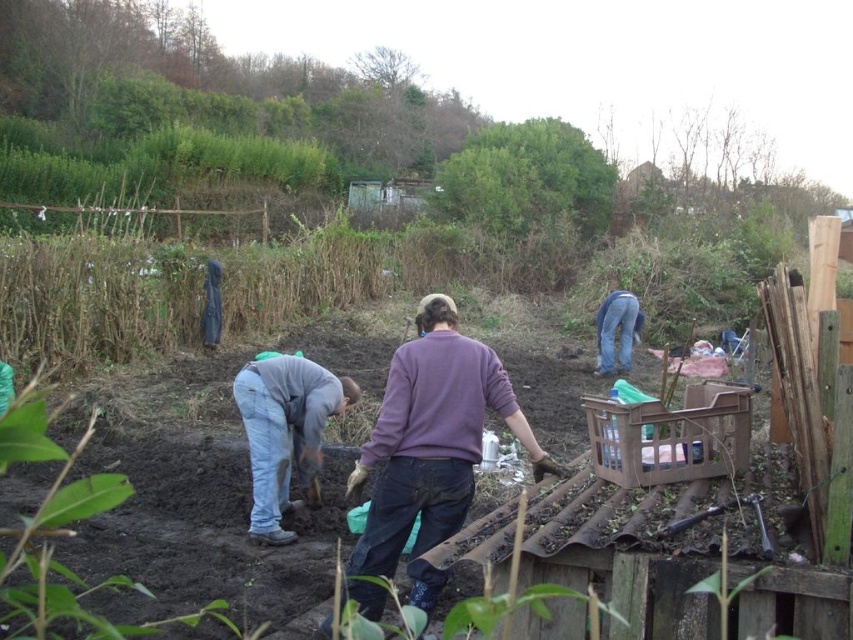
Question: Does denim jeans at lower left lie in front of denim jeans at right?

Choices:
 (A) no
 (B) yes

Answer: (B)

Question: Which object is positioned closest to the purple sweater at center?

Choices:
 (A) denim jeans at lower left
 (B) denim jeans at right
 (C) brown plastic crate at lower right

Answer: (C)

Question: Can you confirm if brown plastic crate at lower right is wider than denim jeans at right?

Choices:
 (A) no
 (B) yes

Answer: (B)

Question: Which of the following is the closest to the observer?

Choices:
 (A) (622, 371)
 (B) (257, 412)
 (C) (456, 452)
 (D) (639, 429)

Answer: (D)

Question: Which point is farther to the camera?

Choices:
 (A) denim jeans at right
 (B) brown plastic crate at lower right
 (C) purple sweater at center

Answer: (A)

Question: Does brown plastic crate at lower right appear on the right side of denim jeans at right?

Choices:
 (A) no
 (B) yes

Answer: (A)